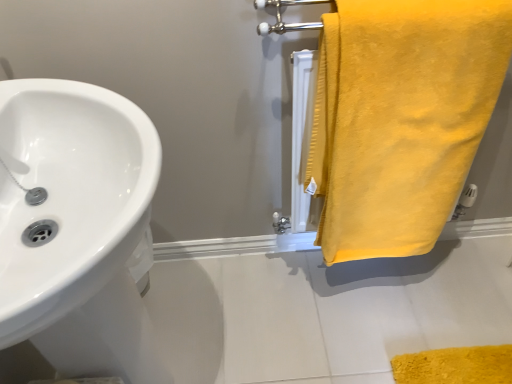
Measure the distance between white glossy sink at left and camera.

white glossy sink at left and camera are 17.55 inches apart from each other.

Where is `white glossy sink at left`? white glossy sink at left is located at coordinates (69, 196).

Describe the element at coordinates (69, 196) in the screenshot. The width and height of the screenshot is (512, 384). I see `white glossy sink at left` at that location.

Identify the location of yellow soft towel at right. The width and height of the screenshot is (512, 384). (401, 118).

What do you see at coordinates (401, 118) in the screenshot?
I see `yellow soft towel at right` at bounding box center [401, 118].

Find the location of a particular element. The width and height of the screenshot is (512, 384). white glossy sink at left is located at coordinates (69, 196).

Can you confirm if white glossy sink at left is positioned to the left of yellow soft towel at right?

Correct, you'll find white glossy sink at left to the left of yellow soft towel at right.

Is white glossy sink at left further to the viewer compared to yellow soft towel at right?

No, it is not.

Which is nearer, (73, 272) or (332, 48)?

Point (73, 272) is closer to the camera than point (332, 48).

From the image's perspective, relative to yellow soft towel at right, is white glossy sink at left above or below?

Based on their image positions, white glossy sink at left is located beneath yellow soft towel at right.

From a real-world perspective, is white glossy sink at left located higher than yellow soft towel at right?

No, from a real-world perspective, white glossy sink at left is not over yellow soft towel at right

Does white glossy sink at left have a lesser width compared to yellow soft towel at right?

No, white glossy sink at left is not thinner than yellow soft towel at right.

Considering the sizes of objects white glossy sink at left and yellow soft towel at right in the image provided, who is shorter, white glossy sink at left or yellow soft towel at right?

With less height is yellow soft towel at right.

Based on their sizes in the image, would you say white glossy sink at left is bigger or smaller than yellow soft towel at right?

Considering their sizes, white glossy sink at left takes up more space than yellow soft towel at right.

Is yellow soft towel at right surrounded by white glossy sink at left?

Definitely not — yellow soft towel at right is not inside white glossy sink at left.

Looking at this image, is white glossy sink at left directly adjacent to yellow soft towel at right?

No, white glossy sink at left is not next to yellow soft towel at right.

Is white glossy sink at left aimed at yellow soft towel at right?

Yes, white glossy sink at left is aimed at yellow soft towel at right.

What are the coordinates of `towel that appears on the right of white glossy sink at left` in the screenshot? It's located at (401, 118).

Based on the photo, can you confirm if yellow soft towel at right is positioned to the left of white glossy sink at left?

Incorrect, yellow soft towel at right is not on the left side of white glossy sink at left.

Considering the positions of objects yellow soft towel at right and white glossy sink at left in the image provided, who is behind, yellow soft towel at right or white glossy sink at left?

yellow soft towel at right is more distant.

Between point (440, 127) and point (33, 163), which one is positioned behind?

The point (440, 127) is more distant.

From the image's perspective, would you say yellow soft towel at right is positioned over white glossy sink at left?

Indeed, from the image's perspective, yellow soft towel at right is shown above white glossy sink at left.

From a real-world perspective, relative to white glossy sink at left, is yellow soft towel at right vertically above or below?

yellow soft towel at right is situated higher than white glossy sink at left in the real world.

Does yellow soft towel at right have a greater width compared to white glossy sink at left?

No, yellow soft towel at right is not wider than white glossy sink at left.

Which of these two, yellow soft towel at right or white glossy sink at left, stands shorter?

yellow soft towel at right.

Considering the relative sizes of yellow soft towel at right and white glossy sink at left in the image provided, is yellow soft towel at right smaller than white glossy sink at left?

Correct, yellow soft towel at right occupies less space than white glossy sink at left.

Is white glossy sink at left inside yellow soft towel at right?

That's incorrect, white glossy sink at left is not inside yellow soft towel at right.

Is yellow soft towel at right far away from white glossy sink at left?

Actually, yellow soft towel at right and white glossy sink at left are a little close together.

Is yellow soft towel at right aimed at white glossy sink at left?

No, yellow soft towel at right is not aimed at white glossy sink at left.

Where is `sink beneath the yellow soft towel at right (from a real-world perspective)`? The image size is (512, 384). sink beneath the yellow soft towel at right (from a real-world perspective) is located at coordinates (69, 196).

I want to click on towel above the white glossy sink at left (from a real-world perspective), so click(x=401, y=118).

Find the location of `towel located behind the white glossy sink at left`. towel located behind the white glossy sink at left is located at coordinates (401, 118).